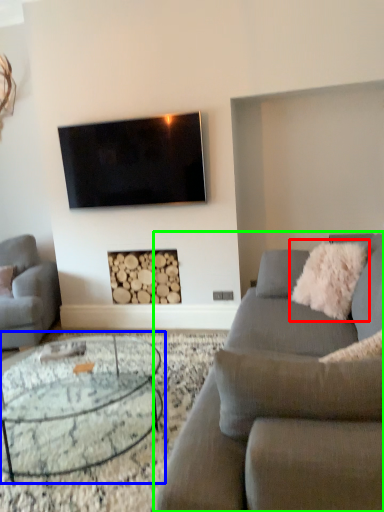
Question: Based on their relative distances, which object is nearer to pillow (highlighted by a red box)? Choose from coffee table (highlighted by a blue box) and studio couch (highlighted by a green box).

Choices:
 (A) coffee table
 (B) studio couch

Answer: (B)